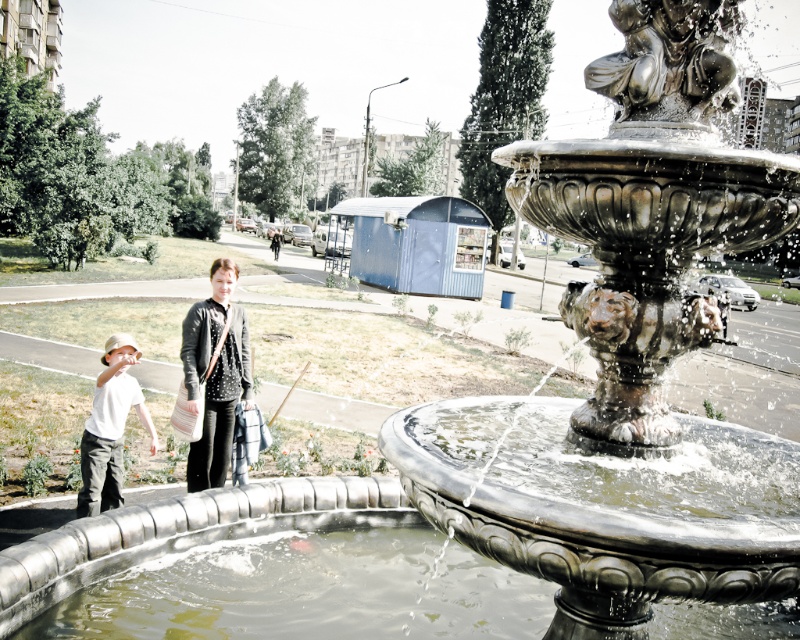
Question: From the image, what is the correct spatial relationship of clear water at fountain center in relation to white matte shirt at lower left?

Choices:
 (A) right
 (B) left

Answer: (A)

Question: Considering the real-world distances, which object is closest to the dark gray sweater at center?

Choices:
 (A) bronze statue at center
 (B) white matte shirt at lower left

Answer: (B)

Question: Among these points, which one is farthest from the camera?

Choices:
 (A) (241, 328)
 (B) (110, 484)
 (C) (280, 232)
 (D) (366, 570)

Answer: (C)

Question: Is clear water at fountain center in front of white matte shirt at lower left?

Choices:
 (A) yes
 (B) no

Answer: (A)

Question: From the image, what is the correct spatial relationship of bronze statue at center in relation to white matte shirt at lower left?

Choices:
 (A) right
 (B) left

Answer: (A)

Question: Estimate the real-world distances between objects in this image. Which object is farther from the clear water at fountain center?

Choices:
 (A) dark gray jacket at center
 (B) dark gray sweater at center
 (C) bronze statue at center

Answer: (A)